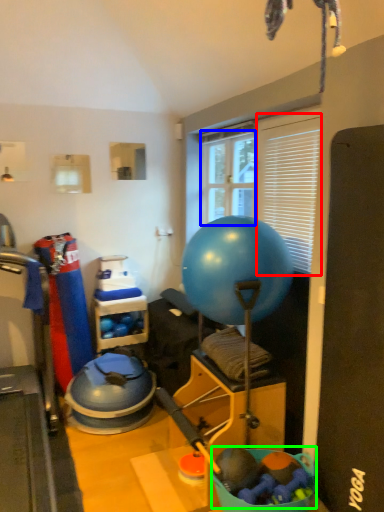
Question: Which is farther away from window screen (highlighted by a red box)? window screen (highlighted by a blue box) or toy (highlighted by a green box)?

Choices:
 (A) window screen
 (B) toy

Answer: (B)